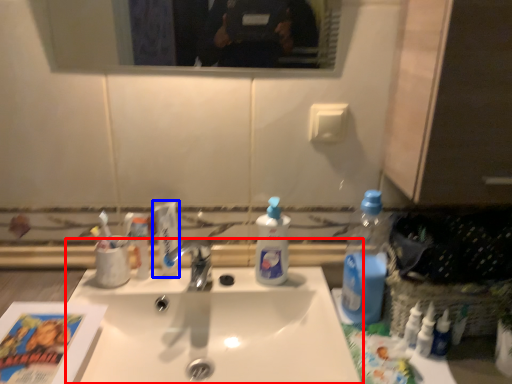
Question: Which object is further to the camera taking this photo, sink (highlighted by a red box) or toothpaste (highlighted by a blue box)?

Choices:
 (A) sink
 (B) toothpaste

Answer: (B)